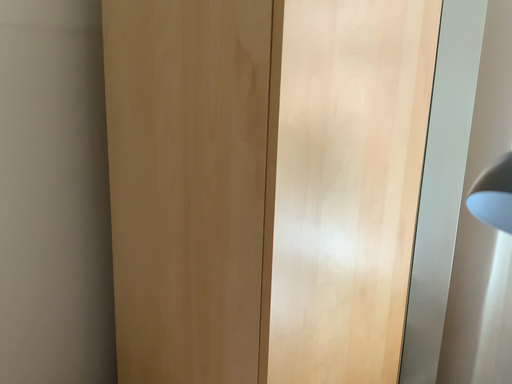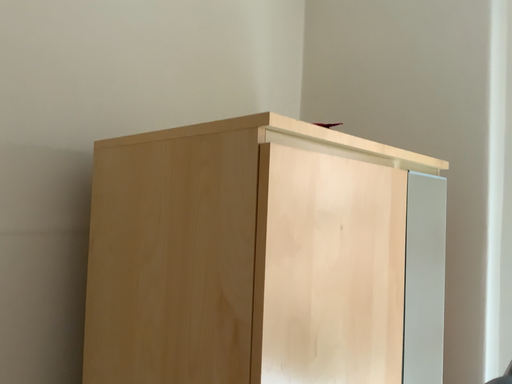
Question: Which way did the camera rotate in the video?

Choices:
 (A) rotated upward
 (B) rotated downward

Answer: (A)